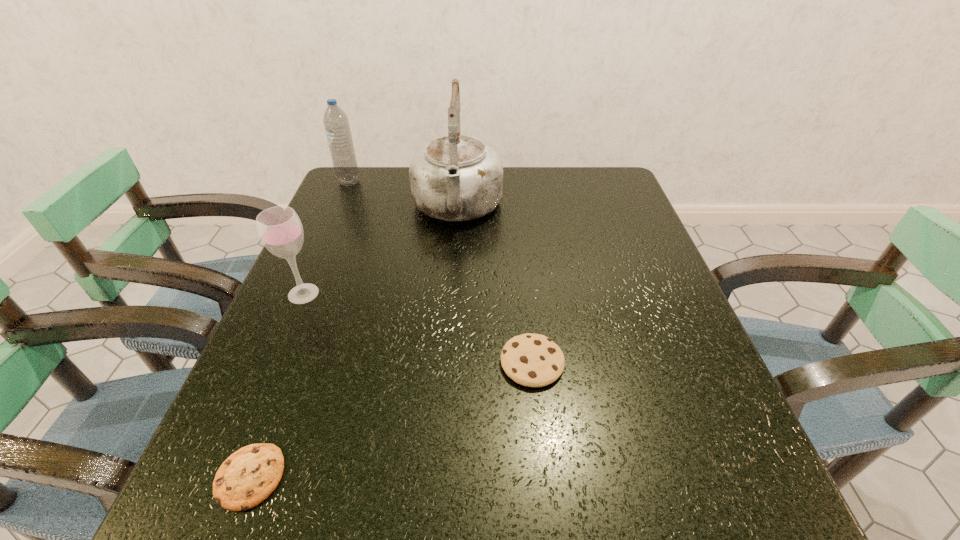
The width and height of the screenshot is (960, 540). Identify the location of object situated at the near left corner. (247, 477).

I want to click on vacant area at the far edge, so click(x=558, y=185).

At what (x,y) coordinates should I click in order to perform the action: click on free space at the near edge of the desktop. Please return your answer as a coordinate pair (x, y). This screenshot has width=960, height=540. Looking at the image, I should click on (445, 478).

Image resolution: width=960 pixels, height=540 pixels. In order to click on free space at the left edge of the desktop in this screenshot , I will do `click(367, 237)`.

Find the location of `vacant space at the right edge`. vacant space at the right edge is located at coordinates (693, 370).

This screenshot has height=540, width=960. Find the location of `vacant area at the far left corner of the desktop`. vacant area at the far left corner of the desktop is located at coordinates (378, 179).

Find the location of a particular element. free space at the near left corner of the desktop is located at coordinates (279, 489).

This screenshot has width=960, height=540. Identify the location of vacant space at the far right corner of the desktop. tap(607, 204).

Find the location of `free point at the near right corner`. free point at the near right corner is located at coordinates (671, 521).

Image resolution: width=960 pixels, height=540 pixels. Identify the location of free area in between the third shortest object and the fourth tallest object. (418, 328).